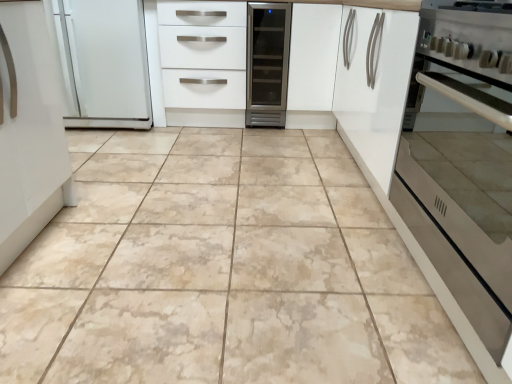
What is the approximate width of white glossy drawers at center?

white glossy drawers at center is 25.47 inches in width.

Find the location of a particular element. This screenshot has width=512, height=384. white glossy drawers at center is located at coordinates (202, 55).

Is satin silver oven at right aimed at beige marble tile at center?

No.

Which is more to the right, satin silver oven at right or beige marble tile at center?

From the viewer's perspective, satin silver oven at right appears more on the right side.

Which is behind, point (452, 303) or point (304, 156)?

The point (304, 156) is more distant.

Are satin silver oven at right and beige marble tile at center making contact?

There is a gap between satin silver oven at right and beige marble tile at center.

Based on the photo, between white glossy drawers at center and white matte cabinet at center, which one has less height?

With less height is white glossy drawers at center.

Measure the distance between white glossy drawers at center and white matte cabinet at center.

22.20 inches.

Is white glossy drawers at center in contact with white matte cabinet at center?

There is a gap between white glossy drawers at center and white matte cabinet at center.

Which is behind, point (223, 9) or point (295, 61)?

Positioned behind is point (295, 61).

You are a GUI agent. You are given a task and a screenshot of the screen. Output one action in this format:
    pyautogui.click(x=<x>, y=<y>)
    Task: Click on the chest of drawers on the left of beige marble tile at center
    
    Given the screenshot: What is the action you would take?
    pyautogui.click(x=202, y=55)

Consider the image. Is white glossy drawers at center inside beige marble tile at center?

No.

From the image's perspective, which is below, beige marble tile at center or white glossy drawers at center?

beige marble tile at center, from the image's perspective.

Considering the sizes of objects beige marble tile at center and white glossy drawers at center in the image provided, who is wider, beige marble tile at center or white glossy drawers at center?

Wider between the two is beige marble tile at center.

The width and height of the screenshot is (512, 384). In order to click on chest of drawers on the left of beige marble tile at center in this screenshot , I will do `click(202, 55)`.

Is white glossy drawers at center next to beige marble tile at center?

No.

Looking at the image, does white glossy drawers at center seem bigger or smaller compared to beige marble tile at center?

Considering their sizes, white glossy drawers at center takes up less space than beige marble tile at center.

Does point (200, 60) appear closer or farther from the camera than point (129, 189)?

Clearly, point (200, 60) is more distant from the camera than point (129, 189).

Considering the sizes of white matte cabinet at center and white glossy drawers at center in the image, is white matte cabinet at center wider or thinner than white glossy drawers at center?

Considering their sizes, white matte cabinet at center looks slimmer than white glossy drawers at center.

Which is in front, white matte cabinet at center or white glossy drawers at center?

Positioned in front is white glossy drawers at center.

Is white matte cabinet at center aimed at white glossy drawers at center?

No, white matte cabinet at center is not facing towards white glossy drawers at center.

Is white matte cabinet at center with white glossy drawers at center?

No, white matte cabinet at center is not with white glossy drawers at center.

Considering the relative positions of white matte cabinet at center and beige marble tile at center in the image provided, is white matte cabinet at center to the right of beige marble tile at center from the viewer's perspective?

Correct, you'll find white matte cabinet at center to the right of beige marble tile at center.

How distant is white matte cabinet at center from beige marble tile at center?

white matte cabinet at center and beige marble tile at center are 4.66 feet apart.

Between white matte cabinet at center and beige marble tile at center, which one has larger size?

beige marble tile at center is bigger.

Identify the location of ceramic tile below the white matte cabinet at center (from the image's perspective). [x=222, y=270].

Is satin silver oven at right aimed at white matte cabinet at center?

No, satin silver oven at right is not facing towards white matte cabinet at center.

Who is taller, satin silver oven at right or white matte cabinet at center?

white matte cabinet at center is taller.

Between satin silver oven at right and white matte cabinet at center, which one is positioned behind?

Positioned behind is white matte cabinet at center.

Where is `ceramic tile above the satin silver oven at right (from the image's perspective)`? ceramic tile above the satin silver oven at right (from the image's perspective) is located at coordinates pyautogui.click(x=222, y=270).

Find the location of a particular element. This screenshot has width=512, height=384. the chest of drawers that is in front of the white matte cabinet at center is located at coordinates (202, 55).

From the image, which object appears to be farther from white glossy drawers at center, white matte cabinet at center or satin silver oven at right?

Based on the image, satin silver oven at right appears to be further to white glossy drawers at center.

Which object lies further to the anchor point beige marble tile at center, satin silver oven at right or white glossy drawers at center?

white glossy drawers at center is positioned further to the anchor beige marble tile at center.

Looking at this image, looking at the image, which one is located further to beige marble tile at center, satin silver oven at right or white matte cabinet at center?

The object further to beige marble tile at center is white matte cabinet at center.

From the image, which object appears to be farther from white glossy drawers at center, satin silver oven at right or beige marble tile at center?

Based on the image, satin silver oven at right appears to be further to white glossy drawers at center.

Looking at the image, which one is located closer to white glossy drawers at center, satin silver oven at right or white matte cabinet at center?

Based on the image, white matte cabinet at center appears to be nearer to white glossy drawers at center.

Looking at the image, which one is located further to white matte cabinet at center, beige marble tile at center or white glossy drawers at center?

The object further to white matte cabinet at center is beige marble tile at center.

Based on the photo, looking at the image, which one is located closer to satin silver oven at right, white matte cabinet at center or beige marble tile at center?

Among the two, beige marble tile at center is located nearer to satin silver oven at right.

Estimate the real-world distances between objects in this image. Which object is further from white matte cabinet at center, beige marble tile at center or satin silver oven at right?

beige marble tile at center lies further to white matte cabinet at center than the other object.

You are a GUI agent. You are given a task and a screenshot of the screen. Output one action in this format:
    pyautogui.click(x=<x>, y=<y>)
    Task: Click on the ceramic tile between satin silver oven at right and white glossy drawers at center from front to back
    
    Given the screenshot: What is the action you would take?
    pyautogui.click(x=222, y=270)

I want to click on the chest of drawers positioned between satin silver oven at right and white matte cabinet at center from near to far, so click(x=202, y=55).

This screenshot has width=512, height=384. I want to click on ceramic tile positioned between satin silver oven at right and white matte cabinet at center from near to far, so click(222, 270).

Identify the location of chest of drawers between beige marble tile at center and white matte cabinet at center along the z-axis. Image resolution: width=512 pixels, height=384 pixels. (202, 55).